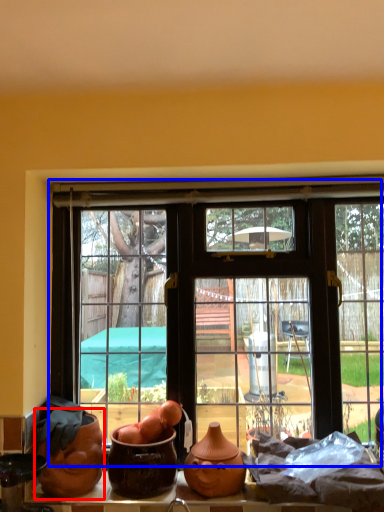
Question: Which point is closer to the camera, pottery (highlighted by a red box) or window (highlighted by a blue box)?

Choices:
 (A) pottery
 (B) window

Answer: (A)